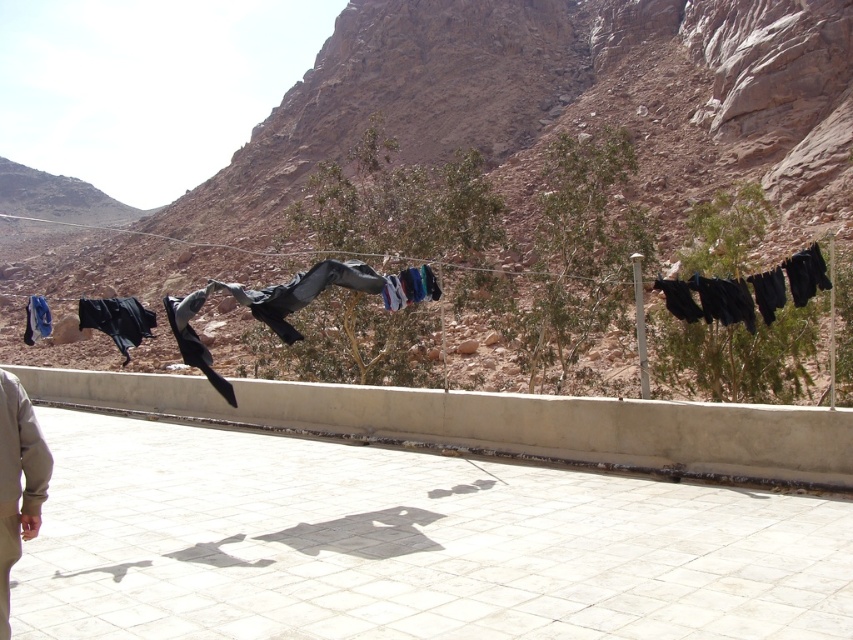
Is dull brown rock at upper center shorter than black matte cloth at left?

No, dull brown rock at upper center is not shorter than black matte cloth at left.

Where is `dull brown rock at upper center`? The image size is (853, 640). dull brown rock at upper center is located at coordinates (546, 134).

Between dull brown rock at upper center and black matte pants at center, which one is positioned lower?

black matte pants at center is lower down.

Is dull brown rock at upper center taller than black matte pants at center?

Indeed, dull brown rock at upper center has a greater height compared to black matte pants at center.

What do you see at coordinates (546, 134) in the screenshot?
I see `dull brown rock at upper center` at bounding box center [546, 134].

I want to click on dull brown rock at upper center, so click(546, 134).

Is point (693, 288) behind point (132, 340)?

No, it is not.

Does point (749, 280) come in front of point (105, 324)?

Yes, point (749, 280) is closer to viewer.

Who is more forward, (x=677, y=288) or (x=142, y=316)?

Point (x=677, y=288) is in front.

Locate an element on the screen. Image resolution: width=853 pixels, height=640 pixels. black fabric pants at right is located at coordinates (747, 291).